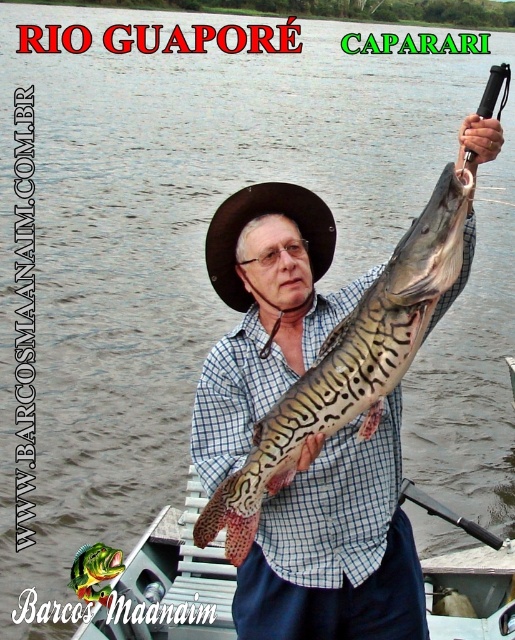
Question: Which point is closer to the camera?

Choices:
 (A) (286, 419)
 (B) (318, 224)

Answer: (A)

Question: Does speckled skin fish at center appear on the right side of brown felt cowboy hat at upper center?

Choices:
 (A) no
 (B) yes

Answer: (B)

Question: Is speckled skin fish at center further to the viewer compared to brown felt cowboy hat at upper center?

Choices:
 (A) yes
 (B) no

Answer: (B)

Question: Among these points, which one is farthest from the camera?

Choices:
 (A) (301, 193)
 (B) (291, 451)

Answer: (A)

Question: Does speckled skin fish at center have a lesser width compared to brown felt cowboy hat at upper center?

Choices:
 (A) no
 (B) yes

Answer: (A)